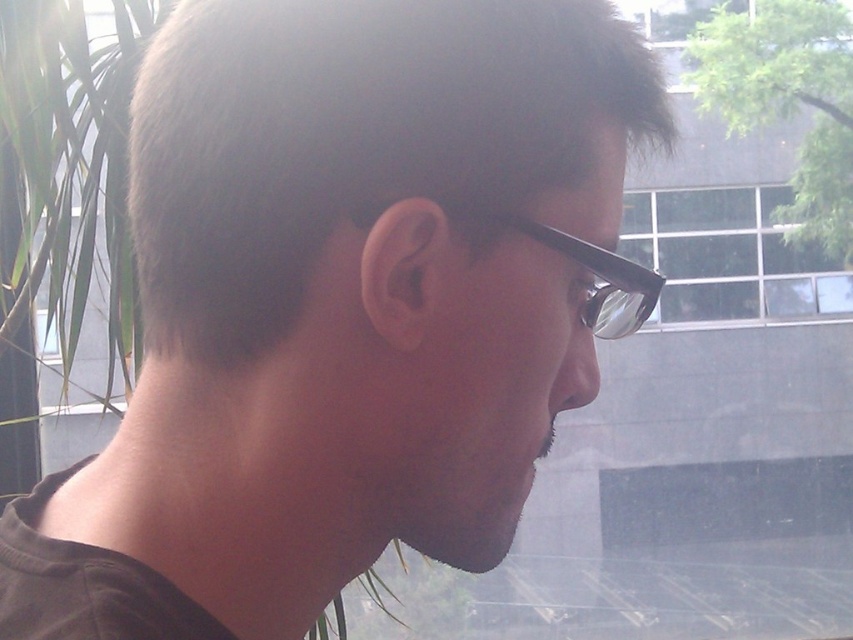
Looking at this image, can you confirm if green leafy plant at upper right is positioned below black plastic glasses at center?

Actually, green leafy plant at upper right is above black plastic glasses at center.

Is point (822, 120) positioned before point (608, 323)?

No, (822, 120) is further to viewer.

Where is `green leafy plant at upper right`? The width and height of the screenshot is (853, 640). green leafy plant at upper right is located at coordinates (788, 100).